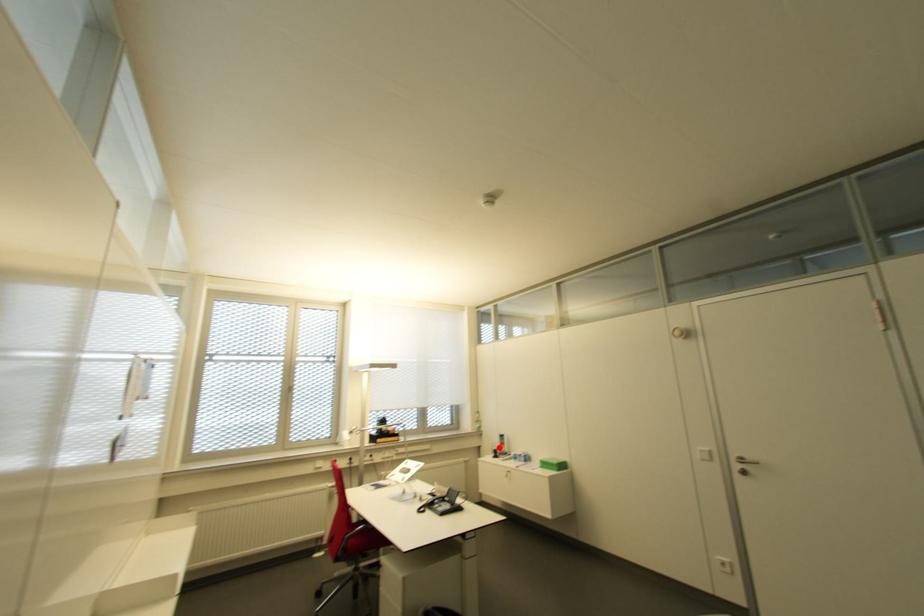
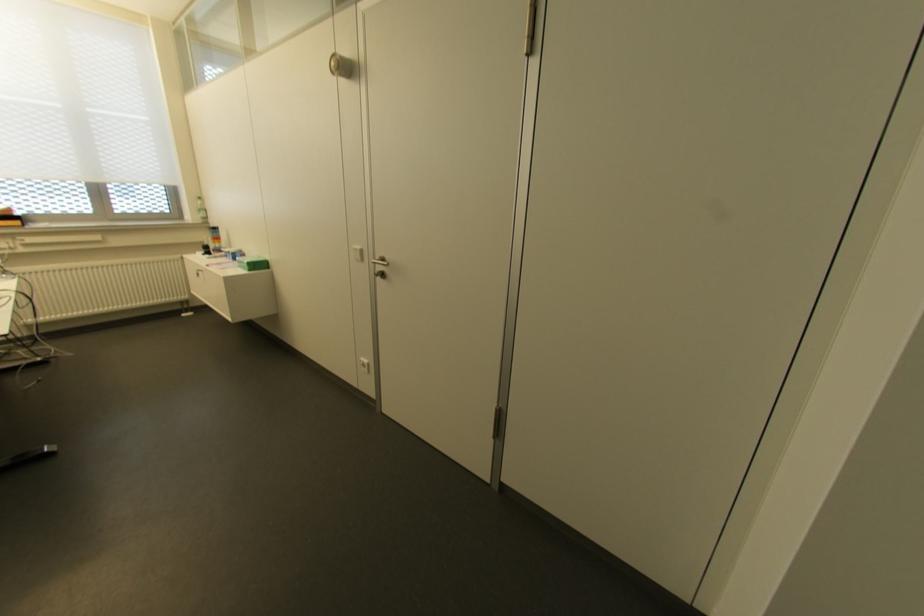
Question: I am providing you with two images of the same scene from different viewpoints. Given a red point in image1, look at the same physical point in image2. Is it:

Choices:
 (A) Closer to the viewpoint
 (B) Farther from the viewpoint

Answer: (A)